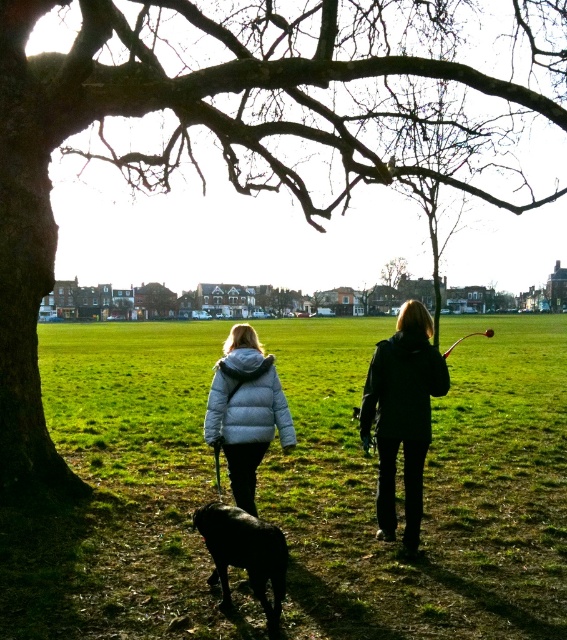
Question: Which object is the closest to the black matte jacket at center?

Choices:
 (A) white puffy jacket at center
 (B) black matte dog at lower center
 (C) green grass at center

Answer: (A)

Question: Does green grass at center lie behind black matte dog at lower center?

Choices:
 (A) yes
 (B) no

Answer: (A)

Question: Which object is the closest to the green grass at center?

Choices:
 (A) black matte dog at lower center
 (B) black matte jacket at center

Answer: (A)

Question: Which point is closer to the camera?

Choices:
 (A) (408, 403)
 (B) (281, 444)

Answer: (A)

Question: Can you confirm if green grass at center is positioned to the left of black matte jacket at center?

Choices:
 (A) yes
 (B) no

Answer: (B)

Question: Is white puffy jacket at center bigger than black matte dog at lower center?

Choices:
 (A) yes
 (B) no

Answer: (A)